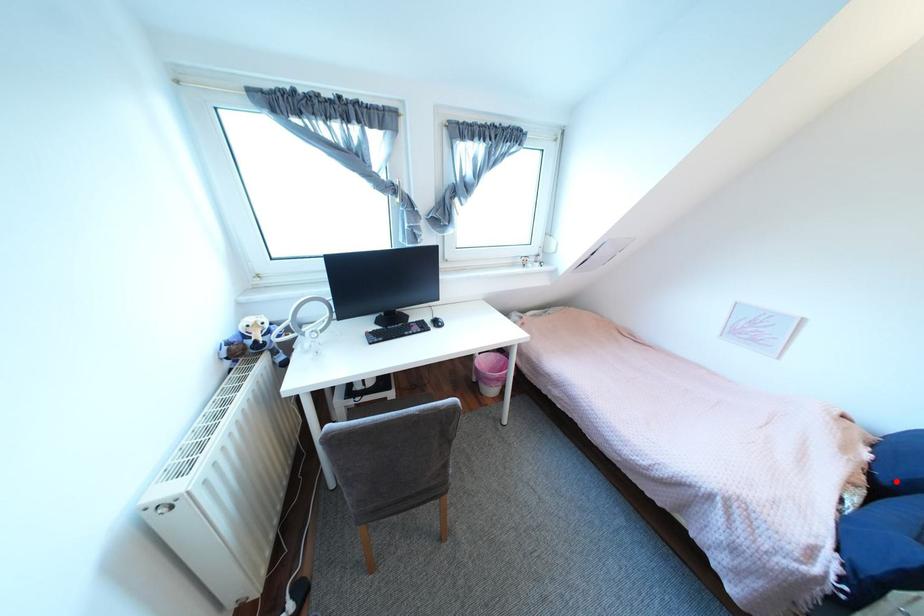
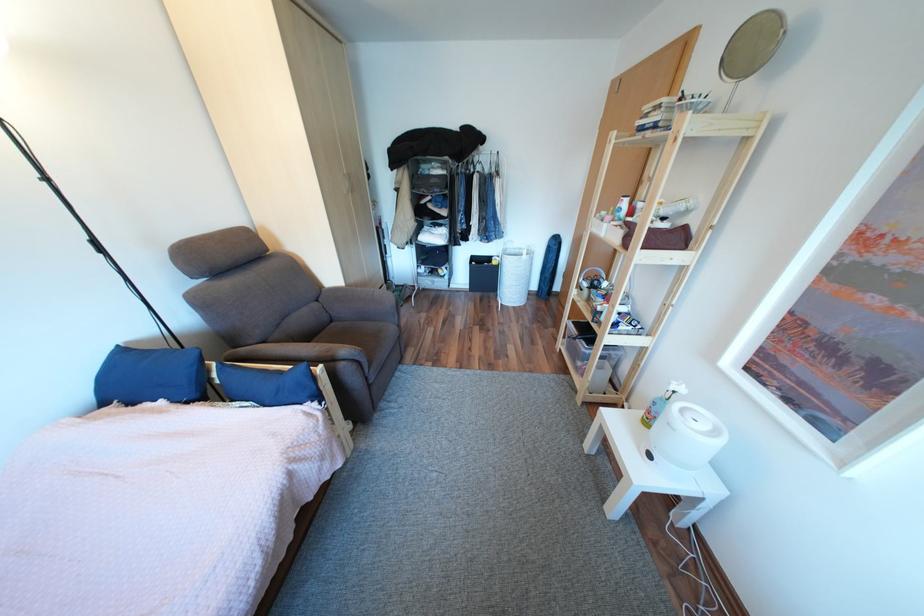
Locate, in the second image, the point that corresponds to the highlighted location in the first image.

(205, 395)